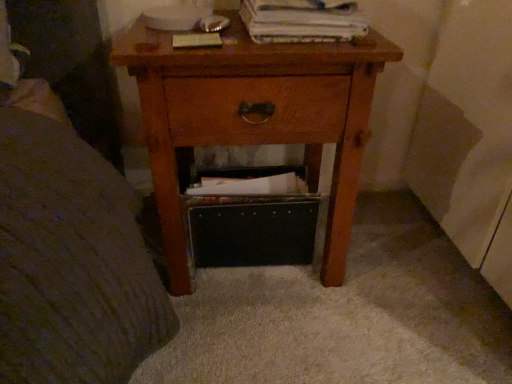
Image resolution: width=512 pixels, height=384 pixels. I want to click on matte brown paperback book at upper center, which is the 1th paperback book from left to right, so click(x=197, y=40).

I want to click on white paper at upper center, arranged as the first paperback book when viewed from the right, so click(300, 22).

Is white paper at upper center, the second paperback book viewed from the left, situated inside matte brown paperback book at upper center, the second paperback book from the right, or outside?

white paper at upper center, the second paperback book viewed from the left, cannot be found inside matte brown paperback book at upper center, the second paperback book from the right.

Is white paper at upper center, arranged as the first paperback book when viewed from the right, in front of or behind matte brown paperback book at upper center, the second paperback book from the right, in the image?

white paper at upper center, arranged as the first paperback book when viewed from the right, is in front of matte brown paperback book at upper center, the second paperback book from the right.

Identify the location of paperback book below the white paper at upper center, the second paperback book viewed from the left (from a real-world perspective). (197, 40).

Identify the location of nightstand below the matte brown paperback book at upper center, the second paperback book from the right (from a real-world perspective). The width and height of the screenshot is (512, 384). (254, 116).

Considering the sizes of objects wooden nightstand at center and matte brown paperback book at upper center, the second paperback book from the right, in the image provided, who is smaller, wooden nightstand at center or matte brown paperback book at upper center, the second paperback book from the right,?

matte brown paperback book at upper center, the second paperback book from the right.

In the scene shown: Which object is further away from the camera taking this photo, wooden nightstand at center or matte brown paperback book at upper center, which is the 1th paperback book from left to right?

matte brown paperback book at upper center, which is the 1th paperback book from left to right.

Are wooden nightstand at center and matte brown paperback book at upper center, which is the 1th paperback book from left to right, located far from each other?

No, wooden nightstand at center is not far away from matte brown paperback book at upper center, which is the 1th paperback book from left to right.

Consider the image. From the image's perspective, which object appears higher, white paper at upper center, the second paperback book viewed from the left, or wooden nightstand at center?

From the image's view, white paper at upper center, the second paperback book viewed from the left, is above.

In the scene shown: Which of these two, white paper at upper center, the second paperback book viewed from the left, or wooden nightstand at center, is thinner?

white paper at upper center, the second paperback book viewed from the left, is thinner.

Where is `the 2nd paperback book above when counting from the wooden nightstand at center (from the image's perspective)`? This screenshot has width=512, height=384. the 2nd paperback book above when counting from the wooden nightstand at center (from the image's perspective) is located at coordinates (300, 22).

Does point (269, 42) appear closer or farther from the camera than point (165, 165)?

Point (269, 42).

Would you say wooden nightstand at center is a long distance from white paper at upper center, arranged as the first paperback book when viewed from the right?

No, wooden nightstand at center is in close proximity to white paper at upper center, arranged as the first paperback book when viewed from the right.

Is white paper at upper center, the second paperback book viewed from the left, located within wooden nightstand at center?

No, white paper at upper center, the second paperback book viewed from the left, is not a part of wooden nightstand at center.

Considering the relative sizes of wooden nightstand at center and white paper at upper center, the second paperback book viewed from the left, in the image provided, is wooden nightstand at center bigger than white paper at upper center, the second paperback book viewed from the left,?

Indeed, wooden nightstand at center has a larger size compared to white paper at upper center, the second paperback book viewed from the left.

How far apart are wooden nightstand at center and white paper at upper center, arranged as the first paperback book when viewed from the right?

They are 7.76 inches apart.

Can you see matte brown paperback book at upper center, which is the 1th paperback book from left to right, touching white paper at upper center, arranged as the first paperback book when viewed from the right?

matte brown paperback book at upper center, which is the 1th paperback book from left to right, and white paper at upper center, arranged as the first paperback book when viewed from the right, are not in contact.

Who is taller, matte brown paperback book at upper center, the second paperback book from the right, or white paper at upper center, the second paperback book viewed from the left?

white paper at upper center, the second paperback book viewed from the left, is taller.

In terms of width, does matte brown paperback book at upper center, the second paperback book from the right, look wider or thinner when compared to white paper at upper center, the second paperback book viewed from the left?

In the image, matte brown paperback book at upper center, the second paperback book from the right, appears to be more narrow than white paper at upper center, the second paperback book viewed from the left.

Is point (204, 43) positioned after point (195, 138)?

No, it is in front of (195, 138).

Between matte brown paperback book at upper center, which is the 1th paperback book from left to right, and wooden nightstand at center, which one has larger width?

Wider between the two is wooden nightstand at center.

From a real-world perspective, is matte brown paperback book at upper center, the second paperback book from the right, above or below wooden nightstand at center?

In terms of real-world spatial position, matte brown paperback book at upper center, the second paperback book from the right, is above wooden nightstand at center.

Is matte brown paperback book at upper center, which is the 1th paperback book from left to right, closer to the viewer compared to wooden nightstand at center?

No, it is behind wooden nightstand at center.

This screenshot has height=384, width=512. Identify the location of paperback book below the white paper at upper center, the second paperback book viewed from the left (from the image's perspective). (197, 40).

The width and height of the screenshot is (512, 384). In order to click on paperback book lying on the left of wooden nightstand at center in this screenshot , I will do `click(197, 40)`.

From the picture: Which object lies further to the anchor point white paper at upper center, arranged as the first paperback book when viewed from the right, matte brown paperback book at upper center, which is the 1th paperback book from left to right, or wooden nightstand at center?

Among the two, wooden nightstand at center is located further to white paper at upper center, arranged as the first paperback book when viewed from the right.

In the scene shown: Estimate the real-world distances between objects in this image. Which object is closer to wooden nightstand at center, matte brown paperback book at upper center, which is the 1th paperback book from left to right, or white paper at upper center, the second paperback book viewed from the left?

white paper at upper center, the second paperback book viewed from the left, lies closer to wooden nightstand at center than the other object.

When comparing their distances from wooden nightstand at center, does white paper at upper center, the second paperback book viewed from the left, or matte brown paperback book at upper center, which is the 1th paperback book from left to right, seem closer?

Among the two, white paper at upper center, the second paperback book viewed from the left, is located nearer to wooden nightstand at center.

Considering their positions, is wooden nightstand at center positioned closer to white paper at upper center, the second paperback book viewed from the left, than matte brown paperback book at upper center, the second paperback book from the right?

The object closer to white paper at upper center, the second paperback book viewed from the left, is matte brown paperback book at upper center, the second paperback book from the right.

Looking at the image, which one is located closer to matte brown paperback book at upper center, the second paperback book from the right, wooden nightstand at center or white paper at upper center, arranged as the first paperback book when viewed from the right?

white paper at upper center, arranged as the first paperback book when viewed from the right, is closer to matte brown paperback book at upper center, the second paperback book from the right.

Considering their positions, is white paper at upper center, arranged as the first paperback book when viewed from the right, positioned closer to matte brown paperback book at upper center, the second paperback book from the right, than wooden nightstand at center?

white paper at upper center, arranged as the first paperback book when viewed from the right, is positioned closer to the anchor matte brown paperback book at upper center, the second paperback book from the right.

The width and height of the screenshot is (512, 384). What are the coordinates of `paperback book between white paper at upper center, arranged as the first paperback book when viewed from the right, and wooden nightstand at center from top to bottom` in the screenshot? It's located at (197, 40).